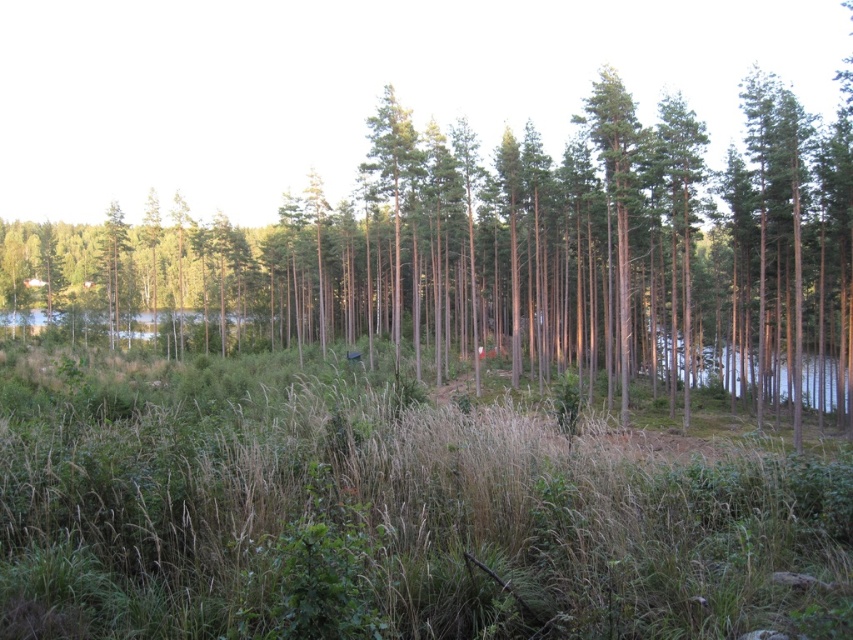
Question: Is green grass at center further to the viewer compared to green smooth tree at center?

Choices:
 (A) yes
 (B) no

Answer: (B)

Question: Can you confirm if green grass at center is thinner than green smooth tree at center?

Choices:
 (A) yes
 (B) no

Answer: (A)

Question: Among these points, which one is farthest from the camera?

Choices:
 (A) (346, 216)
 (B) (590, 536)

Answer: (A)

Question: Which of the following is the farthest from the observer?

Choices:
 (A) green smooth tree at center
 (B) green grass at center

Answer: (A)

Question: Is green grass at center below green smooth tree at center?

Choices:
 (A) no
 (B) yes

Answer: (B)

Question: Among these objects, which one is farthest from the camera?

Choices:
 (A) green grass at center
 (B) green smooth tree at center

Answer: (B)